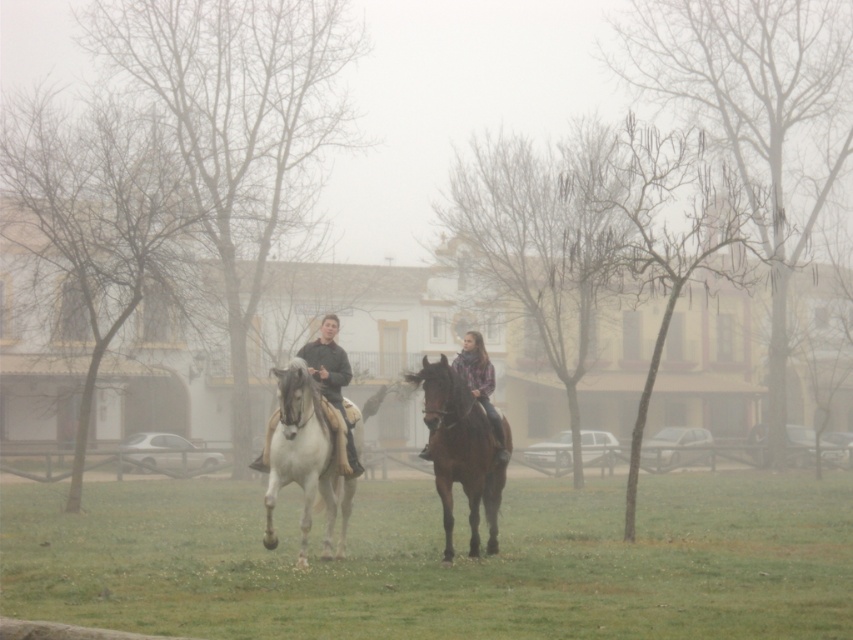
You are a photographer standing in the field and want to capture a photo of the green grass at center and the dark green leather jacket at center. Which object will appear larger in the photo?

The green grass at center will appear larger in the photo because it is closer to the viewer than the dark green leather jacket at center.

You are a photographer trying to capture the brown glossy horse at center and the dark green leather jacket at center in a single shot. Based on their sizes, which one should you focus on to ensure both are clearly visible in your photo?

The brown glossy horse at center is larger in size than the dark green leather jacket at center, so you should focus on the brown glossy horse at center to ensure both are clearly visible in the photo.